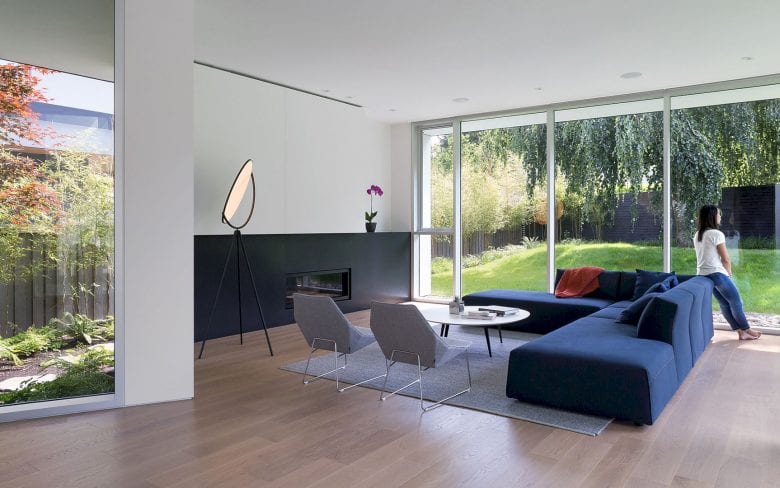
Identify the location of gray chair. This screenshot has width=780, height=488. (332, 322), (416, 329).